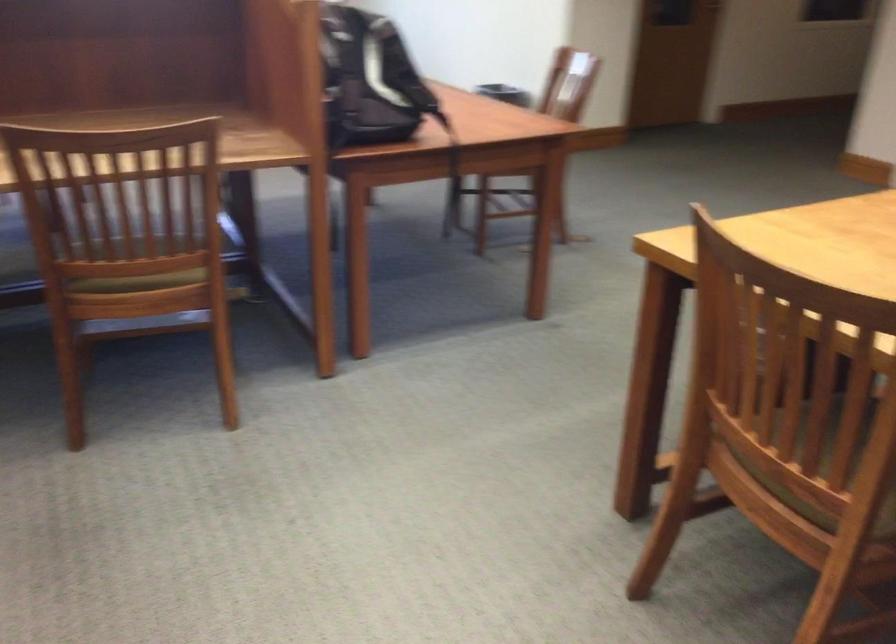
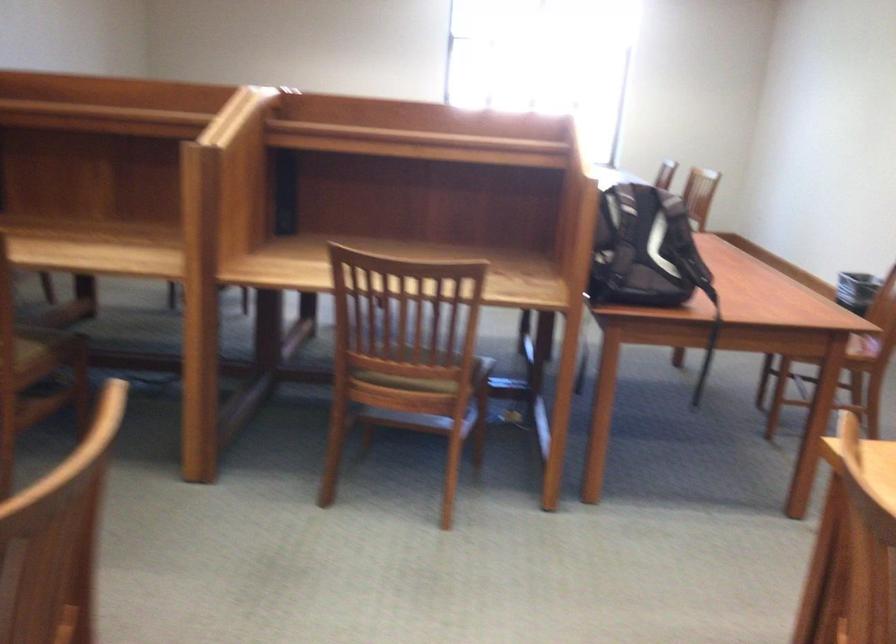
Question: The camera is either moving clockwise (left) or counter-clockwise (right) around the object. The first image is from the beginning of the video and the second image is from the end. Is the camera moving left or right when shooting the video?

Choices:
 (A) Left
 (B) Right

Answer: (B)